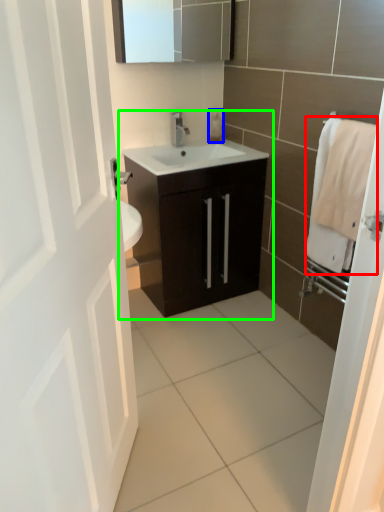
Question: Which object is positioned closest to bath towel (highlighted by a red box)? Select from soap dispenser (highlighted by a blue box) and bathroom cabinet (highlighted by a green box).

Choices:
 (A) soap dispenser
 (B) bathroom cabinet

Answer: (B)